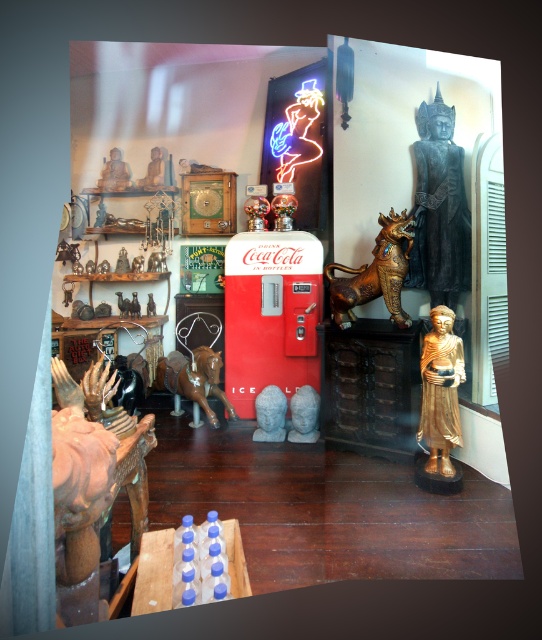
Is wooden statue at lower left smaller than bronze/golden statue at center-right?

Incorrect, wooden statue at lower left is not smaller in size than bronze/golden statue at center-right.

Which is in front, point (81, 538) or point (404, 260)?

Point (81, 538) is in front.

In order to click on wooden statue at lower left in this screenshot , I will do `click(92, 484)`.

The image size is (542, 640). What do you see at coordinates (438, 209) in the screenshot?
I see `black polished wood statue at upper right` at bounding box center [438, 209].

Where is `black polished wood statue at upper right`? black polished wood statue at upper right is located at coordinates (438, 209).

Between point (235, 416) and point (106, 164), which one is positioned in front?

Point (235, 416)

Can you confirm if brown wooden horse at center is positioned above matte gold statue at upper left?

Incorrect, brown wooden horse at center is not positioned above matte gold statue at upper left.

The image size is (542, 640). What do you see at coordinates (195, 380) in the screenshot?
I see `brown wooden horse at center` at bounding box center [195, 380].

At what (x,y) coordinates should I click in order to perform the action: click on brown wooden horse at center. Please return your answer as a coordinate pair (x, y). Looking at the image, I should click on (195, 380).